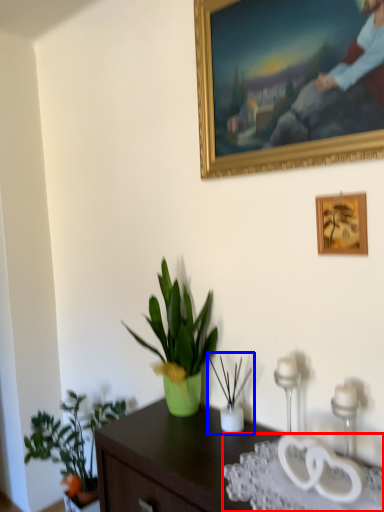
Question: Which object appears farthest to the camera in this image, glass table (highlighted by a red box) or houseplant (highlighted by a blue box)?

Choices:
 (A) glass table
 (B) houseplant

Answer: (B)